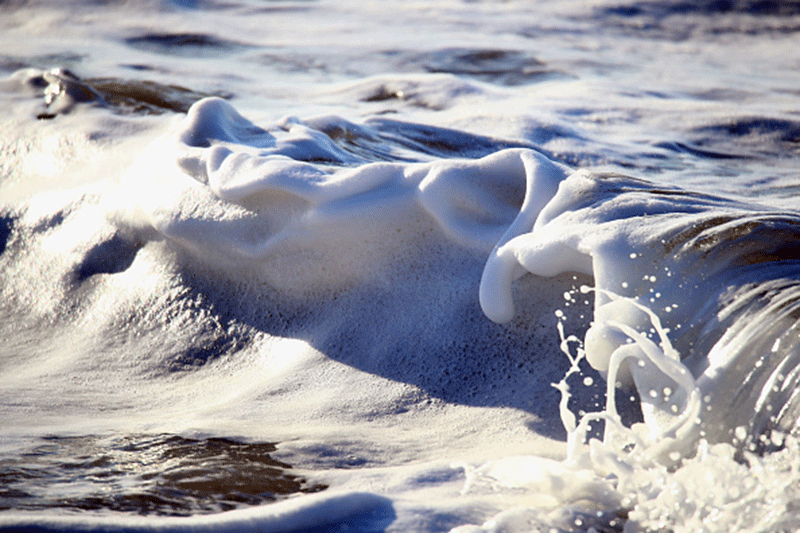
Locate an element on the screen. The image size is (800, 533). foam is located at coordinates (540, 465).